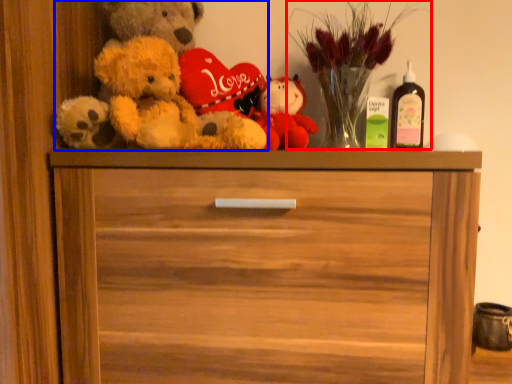
Question: Which of the following is the farthest to the observer, floral arrangement (highlighted by a red box) or teddy bear (highlighted by a blue box)?

Choices:
 (A) floral arrangement
 (B) teddy bear

Answer: (A)